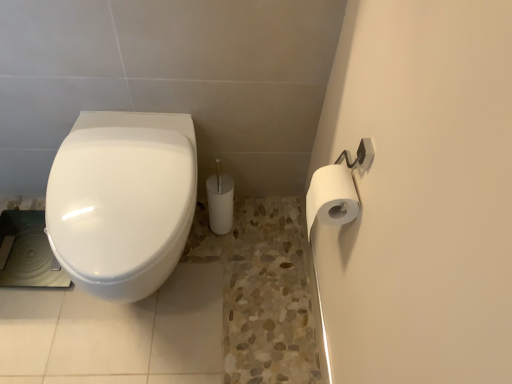
What do you see at coordinates (331, 197) in the screenshot? The height and width of the screenshot is (384, 512). I see `white matte toilet paper at upper right` at bounding box center [331, 197].

This screenshot has height=384, width=512. What are the coordinates of `white matte toilet paper at upper right` in the screenshot? It's located at (331, 197).

In order to click on white glossy toilet at left in this screenshot , I will do [x=122, y=201].

Image resolution: width=512 pixels, height=384 pixels. Describe the element at coordinates (122, 201) in the screenshot. I see `white glossy toilet at left` at that location.

Locate an element on the screen. The image size is (512, 384). white matte toilet paper at upper right is located at coordinates (331, 197).

Considering the relative positions of white matte toilet paper at upper right and white glossy toilet at left in the image provided, is white matte toilet paper at upper right to the left or to the right of white glossy toilet at left?

Clearly, white matte toilet paper at upper right is on the right of white glossy toilet at left in the image.

Between white matte toilet paper at upper right and white glossy toilet at left, which one is positioned behind?

white glossy toilet at left is further away from the camera.

Is point (322, 184) positioned in front of point (158, 129)?

Yes, it is.

From the image's perspective, is white matte toilet paper at upper right above or below white glossy toilet at left?

From the image's perspective, white matte toilet paper at upper right appears above white glossy toilet at left.

From a real-world perspective, is white matte toilet paper at upper right above or below white glossy toilet at left?

From a real-world perspective, white matte toilet paper at upper right is physically above white glossy toilet at left.

Consider the image. Is white matte toilet paper at upper right wider or thinner than white glossy toilet at left?

In the image, white matte toilet paper at upper right appears to be more narrow than white glossy toilet at left.

Does white matte toilet paper at upper right have a greater height compared to white glossy toilet at left?

No, white matte toilet paper at upper right is not taller than white glossy toilet at left.

In the scene shown: Considering the sizes of white matte toilet paper at upper right and white glossy toilet at left in the image, is white matte toilet paper at upper right bigger or smaller than white glossy toilet at left?

Clearly, white matte toilet paper at upper right is smaller in size than white glossy toilet at left.

Is white matte toilet paper at upper right inside or outside of white glossy toilet at left?

The correct answer is: outside.

Is there a large distance between white matte toilet paper at upper right and white glossy toilet at left?

That's not correct — white matte toilet paper at upper right is a little close to white glossy toilet at left.

Is white matte toilet paper at upper right turned away from white glossy toilet at left?

No, white matte toilet paper at upper right's orientation is not away from white glossy toilet at left.

How distant is white matte toilet paper at upper right from white glossy toilet at left?

A distance of 18.88 inches exists between white matte toilet paper at upper right and white glossy toilet at left.

The height and width of the screenshot is (384, 512). I want to click on toilet paper in front of the white glossy toilet at left, so click(331, 197).

Is white glossy toilet at left at the left side of white matte toilet paper at upper right?

Indeed, white glossy toilet at left is positioned on the left side of white matte toilet paper at upper right.

Considering their positions, is white glossy toilet at left located in front of or behind white matte toilet paper at upper right?

white glossy toilet at left is behind white matte toilet paper at upper right.

Is point (159, 153) closer or farther from the camera than point (338, 210)?

Point (159, 153) is positioned farther from the camera compared to point (338, 210).

From the image's perspective, would you say white glossy toilet at left is shown under white matte toilet paper at upper right?

Yes, from the image's perspective, white glossy toilet at left is below white matte toilet paper at upper right.

In the scene shown: From a real-world perspective, is white glossy toilet at left positioned under white matte toilet paper at upper right based on gravity?

Yes.

Which object is wider, white glossy toilet at left or white matte toilet paper at upper right?

white glossy toilet at left.

From their relative heights in the image, would you say white glossy toilet at left is taller or shorter than white matte toilet paper at upper right?

Clearly, white glossy toilet at left is taller compared to white matte toilet paper at upper right.

Considering the sizes of objects white glossy toilet at left and white matte toilet paper at upper right in the image provided, who is smaller, white glossy toilet at left or white matte toilet paper at upper right?

white matte toilet paper at upper right is smaller.

Would you say white matte toilet paper at upper right is part of white glossy toilet at left's contents?

No, white matte toilet paper at upper right is not inside white glossy toilet at left.

Is there a large distance between white glossy toilet at left and white matte toilet paper at upper right?

No.

Is white glossy toilet at left aimed at white matte toilet paper at upper right?

No, white glossy toilet at left is not turned towards white matte toilet paper at upper right.

Can you tell me how much white glossy toilet at left and white matte toilet paper at upper right differ in facing direction?

white glossy toilet at left and white matte toilet paper at upper right are facing 89.9 degrees away from each other.

How distant is white glossy toilet at left from white matte toilet paper at upper right?

white glossy toilet at left is 18.88 inches from white matte toilet paper at upper right.

Identify the location of toilet on the left of the white matte toilet paper at upper right. This screenshot has height=384, width=512. (122, 201).

The width and height of the screenshot is (512, 384). In order to click on toilet located below the white matte toilet paper at upper right (from the image's perspective) in this screenshot , I will do `click(122, 201)`.

The image size is (512, 384). Identify the location of toilet beneath the white matte toilet paper at upper right (from a real-world perspective). (122, 201).